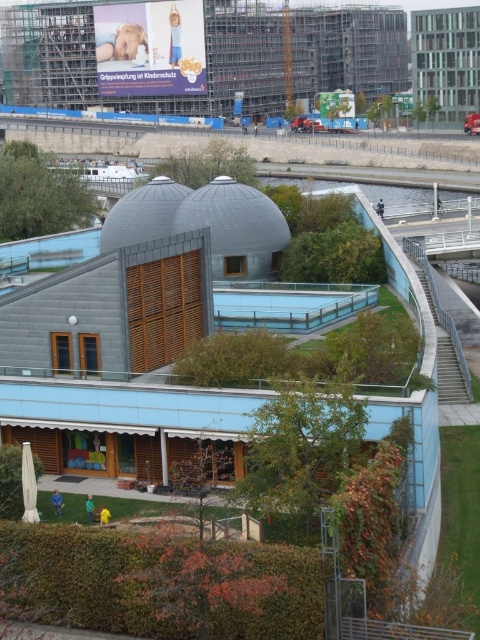
You are standing in front of the modern building and want to locate the green leafy hedge at upper center. What are the coordinates where you can find it?

The green leafy hedge at upper center is located at coordinates point (207,164).